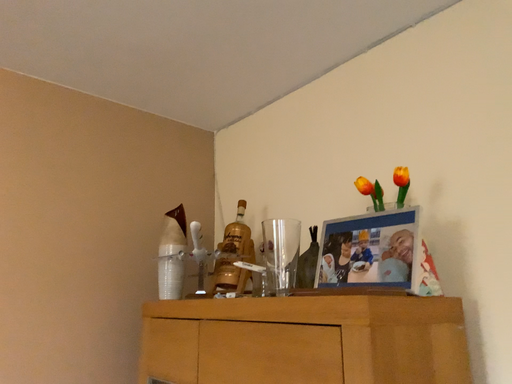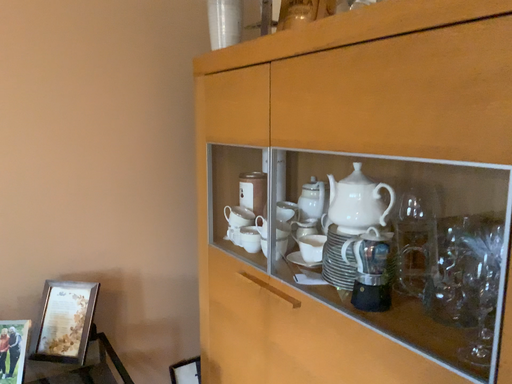
Question: Which way did the camera rotate in the video?

Choices:
 (A) rotated upward
 (B) rotated downward

Answer: (B)